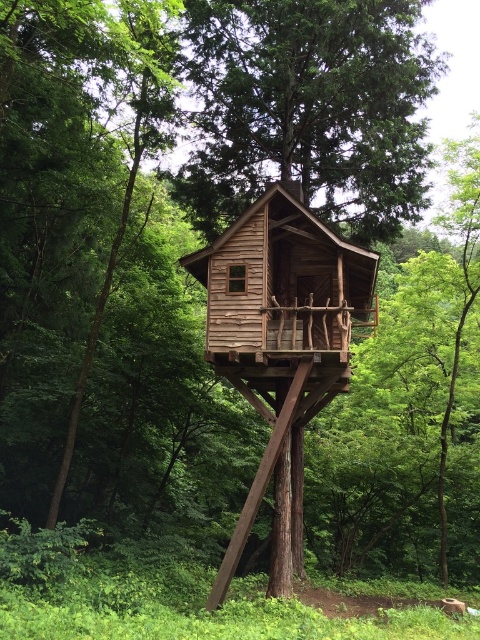
You are standing in the forest and see both the brown wooden house at center and the wooden cabin at center. Which one is positioned to the right side?

The brown wooden house at center is positioned to the right of the wooden cabin at center.

You are planning to move a large sofa that is 2 meters wide into the brown wooden cabin at center or the brown wooden house at center. Based on the scene, which structure would be more suitable for accommodating the sofa?

The brown wooden house at center has a greater width than the brown wooden cabin at center, so the sofa would fit better in the brown wooden house at center.